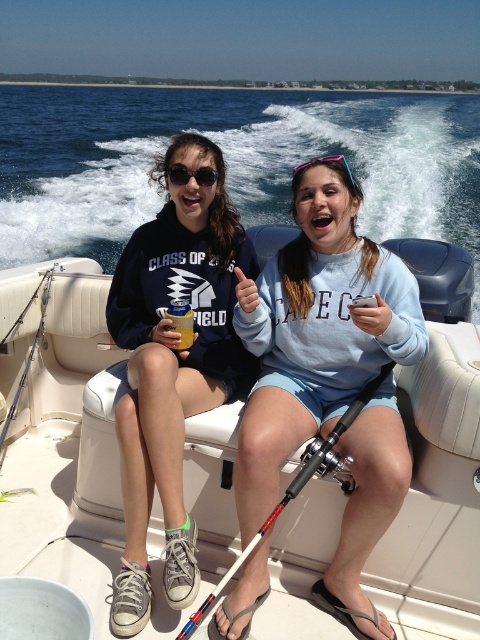
Which is in front, point (16, 461) or point (191, 177)?

Point (191, 177)

Does point (48, 541) lie in front of point (203, 186)?

No.

Locate an element on the screen. Image resolution: width=480 pixels, height=640 pixels. white plastic boat at center is located at coordinates (69, 444).

Describe the element at coordinates (172, 364) in the screenshot. This screenshot has width=480, height=640. I see `matte black hoodie at center` at that location.

Is matte black hoodie at center bigger than red and black fishing pole at center?

Yes.

Describe the element at coordinates (172, 364) in the screenshot. I see `matte black hoodie at center` at that location.

Locate an element on the screen. matte black hoodie at center is located at coordinates (172, 364).

Is matte black hoodie at center closer to the viewer compared to matte black sunglasses at upper center?

That is True.

Does matte black hoodie at center appear under matte black sunglasses at upper center?

Yes, matte black hoodie at center is below matte black sunglasses at upper center.

Between point (222, 388) and point (171, 180), which one is positioned in front?

Point (171, 180) is more forward.

Where is `matte black hoodie at center`? The height and width of the screenshot is (640, 480). matte black hoodie at center is located at coordinates (172, 364).